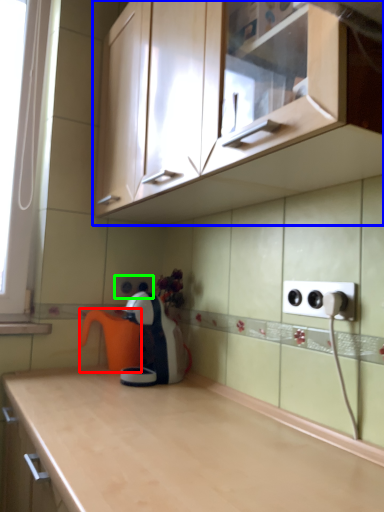
Question: Based on their relative distances, which object is nearer to coffeepot (highlighted by a red box)? Choose from cabinetry (highlighted by a blue box) and electric outlet (highlighted by a green box).

Choices:
 (A) cabinetry
 (B) electric outlet

Answer: (B)